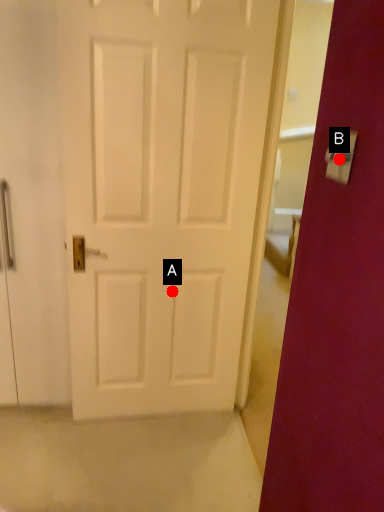
Question: Two points are circled on the image, labeled by A and B beside each circle. Which point is further to the camera?

Choices:
 (A) A is further
 (B) B is further

Answer: (A)